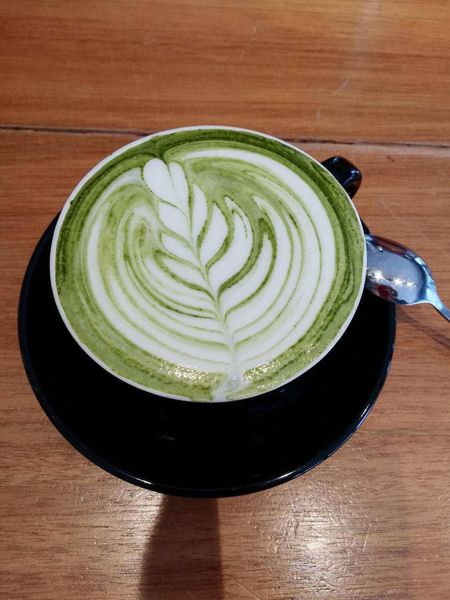
This screenshot has width=450, height=600. In order to click on spoon in this screenshot , I will do `click(396, 270)`.